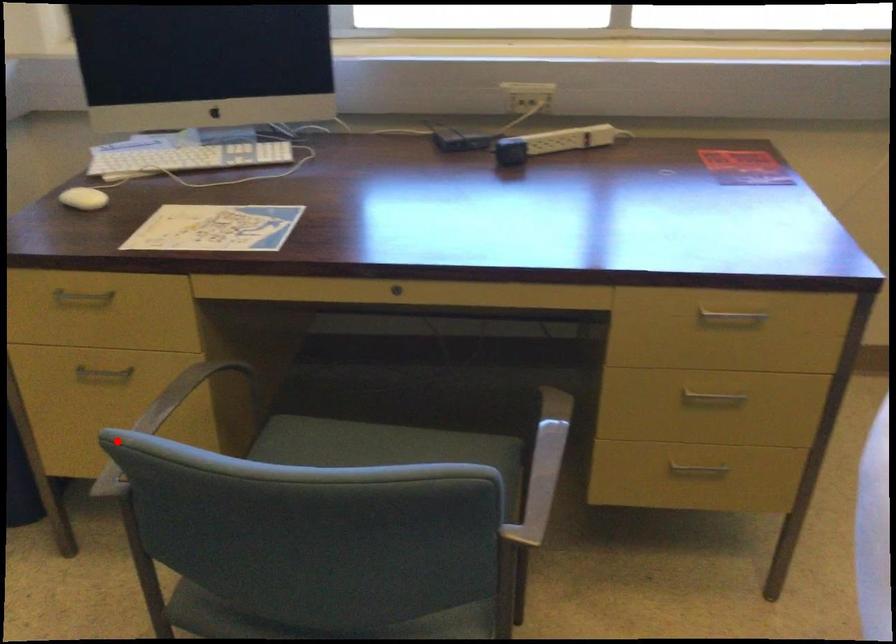
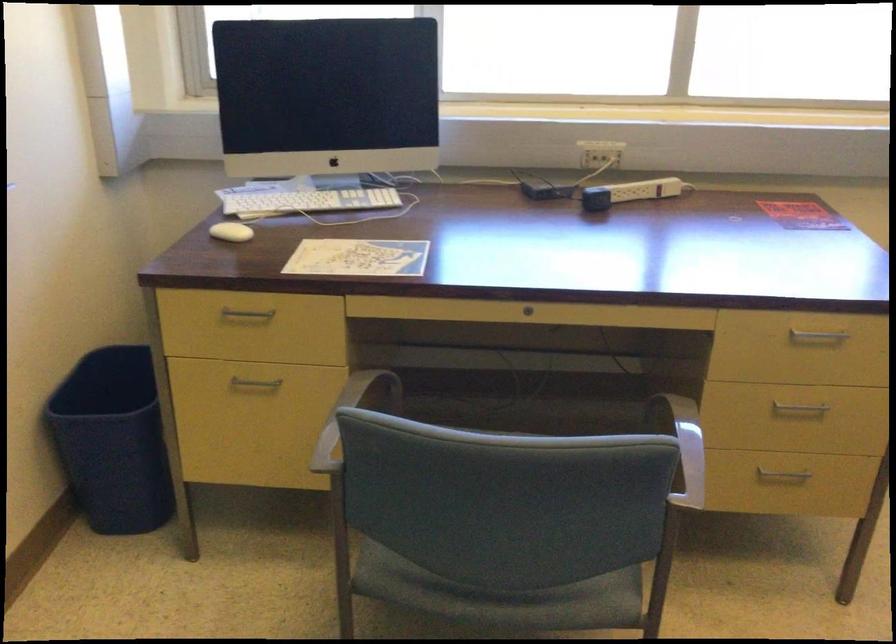
Where in the second image is the point corresponding to the highlighted location from the first image?

(350, 415)